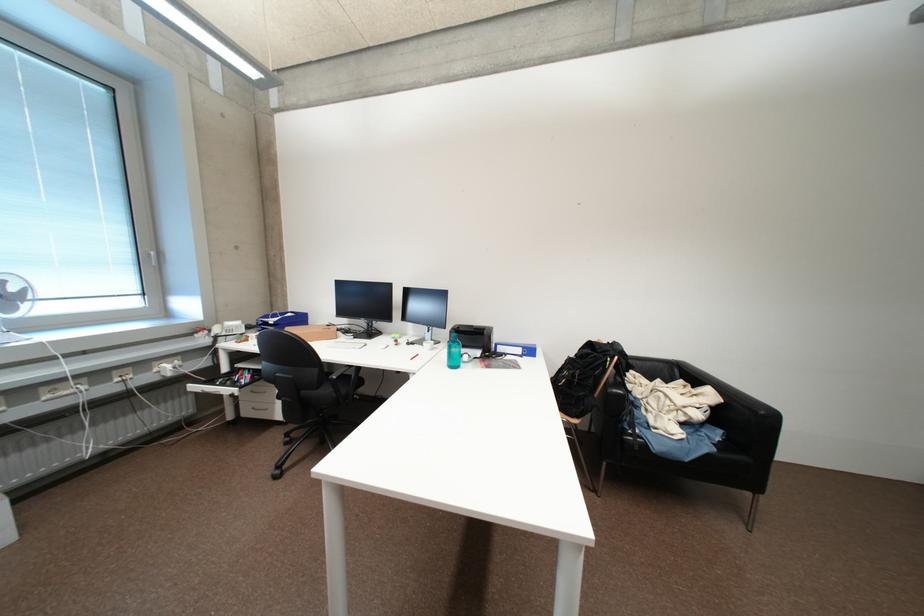
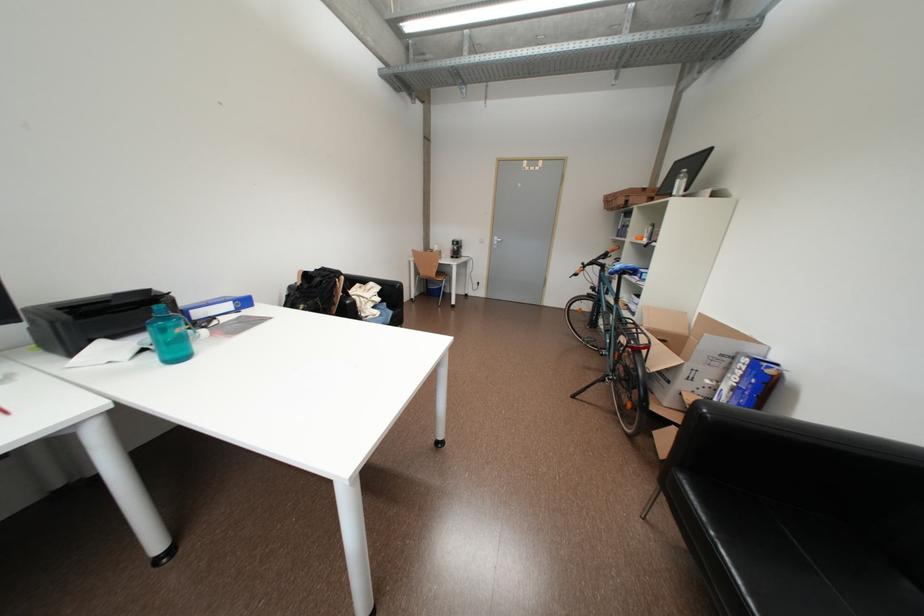
Find the pixel in the second image that matches the point at 596,357 in the first image.

(330, 284)